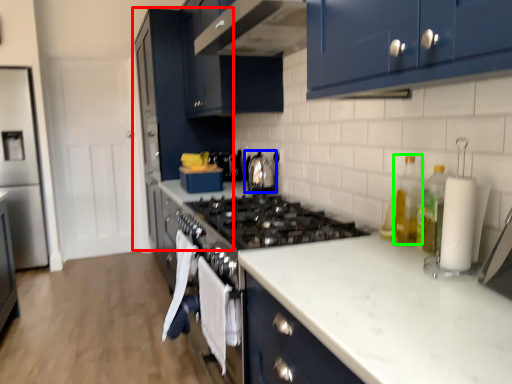
Question: Which object is the closest to the cabinetry (highlighted by a red box)? Choose among these: kitchen appliance (highlighted by a blue box) or bottle (highlighted by a green box).

Choices:
 (A) kitchen appliance
 (B) bottle

Answer: (A)